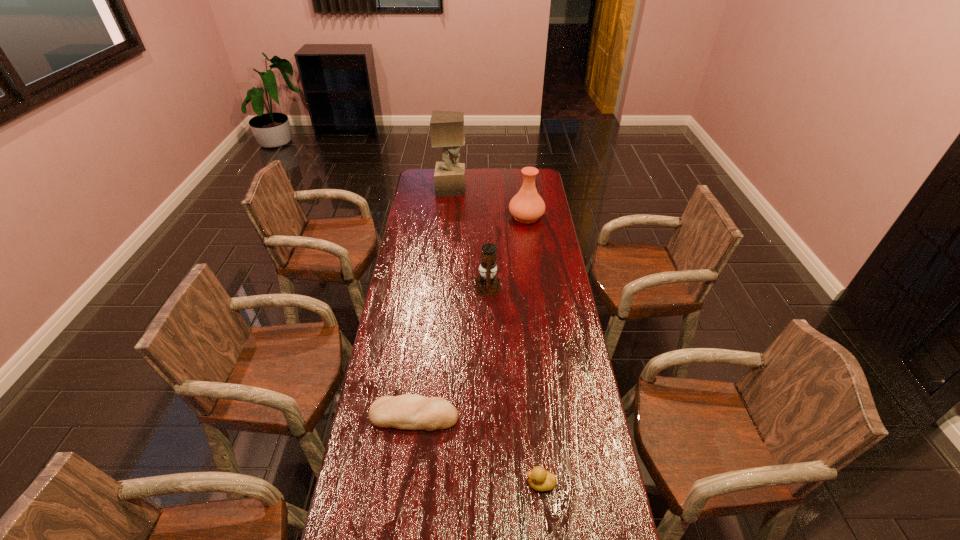
Where is `the tallest object`? The width and height of the screenshot is (960, 540). the tallest object is located at coordinates (447, 127).

I want to click on the farthest object, so click(447, 127).

The width and height of the screenshot is (960, 540). Identify the location of vase. (526, 206).

Find the location of a particular element. The height and width of the screenshot is (540, 960). the third nearest object is located at coordinates (487, 284).

Locate an element on the screen. the third object from right to left is located at coordinates (487, 284).

You are a GUI agent. You are given a task and a screenshot of the screen. Output one action in this format:
    pyautogui.click(x=<x>, y=<y>)
    Task: Click on the second shortest object
    
    Given the screenshot: What is the action you would take?
    pyautogui.click(x=539, y=479)

What are the coordinates of `the nearest object` in the screenshot? It's located at (539, 479).

Locate an element on the screen. The height and width of the screenshot is (540, 960). the shortest object is located at coordinates (408, 411).

This screenshot has height=540, width=960. In order to click on the fourth farthest object in this screenshot , I will do `click(408, 411)`.

Identify the location of vacant region located on the front-facing side of the sculpture. pyautogui.click(x=497, y=189).